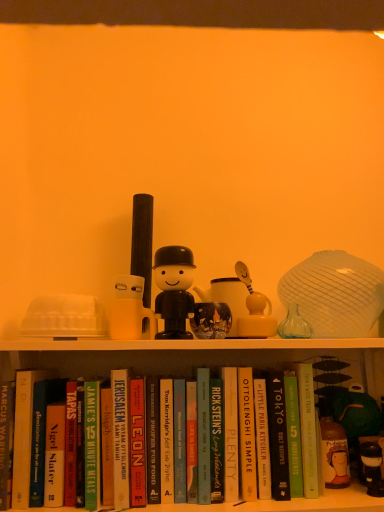
Question: Which direction should I rotate to look at matte glass mug at center, acting as the 2th toy starting from the left?

Choices:
 (A) left
 (B) right

Answer: (B)

Question: Is hardcover book at center, which ranks as the 5th paperback book in left-to-right order, to the right of hardcover book at center, acting as the fourth paperback book starting from the right, from the viewer's perspective?

Choices:
 (A) yes
 (B) no

Answer: (B)

Question: Are hardcover book at center, the 7th paperback book positioned from the right, and hardcover book at center, which is the 8th paperback book from left to right, making contact?

Choices:
 (A) yes
 (B) no

Answer: (B)

Question: Is hardcover book at center, which ranks as the 5th paperback book in left-to-right order, positioned with its back to hardcover book at center, acting as the fourth paperback book starting from the right?

Choices:
 (A) no
 (B) yes

Answer: (A)

Question: From the image's perspective, is hardcover book at center, which ranks as the 5th paperback book in left-to-right order, on top of hardcover book at center, acting as the fourth paperback book starting from the right?

Choices:
 (A) no
 (B) yes

Answer: (A)

Question: From a real-world perspective, is hardcover book at center, which ranks as the 5th paperback book in left-to-right order, physically above hardcover book at center, which is the 8th paperback book from left to right?

Choices:
 (A) yes
 (B) no

Answer: (B)

Question: Considering the relative sizes of hardcover book at center, the 7th paperback book positioned from the right, and hardcover book at center, acting as the fourth paperback book starting from the right, in the image provided, is hardcover book at center, the 7th paperback book positioned from the right, thinner than hardcover book at center, acting as the fourth paperback book starting from the right,?

Choices:
 (A) yes
 (B) no

Answer: (B)

Question: Is green matte book at center, which ranks as the second paperback book in right-to-left order, taller than hardcover book at center, marked as the first paperback book in a left-to-right arrangement?

Choices:
 (A) yes
 (B) no

Answer: (B)

Question: Is hardcover book at center, marked as the first paperback book in a left-to-right arrangement, at the back of green matte book at center, which ranks as the second paperback book in right-to-left order?

Choices:
 (A) no
 (B) yes

Answer: (A)

Question: From the image's perspective, does green matte book at center, which ranks as the second paperback book in right-to-left order, appear lower than hardcover book at center, marked as the first paperback book in a left-to-right arrangement?

Choices:
 (A) yes
 (B) no

Answer: (A)

Question: From a real-world perspective, is green matte book at center, which ranks as the second paperback book in right-to-left order, positioned over hardcover book at center, marked as the first paperback book in a left-to-right arrangement, based on gravity?

Choices:
 (A) yes
 (B) no

Answer: (B)

Question: Considering the relative sizes of green matte book at center, which ranks as the second paperback book in right-to-left order, and hardcover book at center, marked as the first paperback book in a left-to-right arrangement, in the image provided, is green matte book at center, which ranks as the second paperback book in right-to-left order, smaller than hardcover book at center, marked as the first paperback book in a left-to-right arrangement,?

Choices:
 (A) no
 (B) yes

Answer: (B)

Question: Does green matte book at center, which ranks as the tenth paperback book in left-to-right order, have a lesser height compared to hardcover book at center, marked as the first paperback book in a left-to-right arrangement?

Choices:
 (A) no
 (B) yes

Answer: (B)

Question: Is hardcover book at center, which is the 8th paperback book from left to right, oriented towards hardcover book at center, marked as the ninth paperback book in a left-to-right arrangement?

Choices:
 (A) no
 (B) yes

Answer: (A)